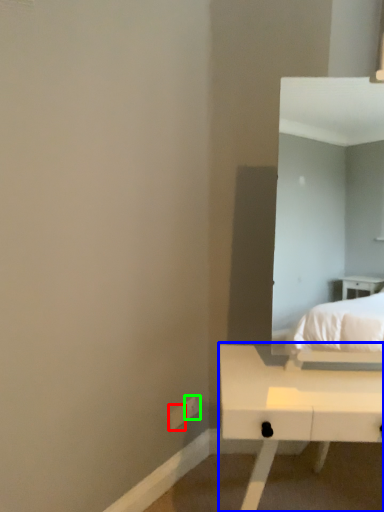
Question: Which object is the closest to the electric outlet (highlighted by a red box)? Choose among these: table (highlighted by a blue box) or electric outlet (highlighted by a green box).

Choices:
 (A) table
 (B) electric outlet

Answer: (B)